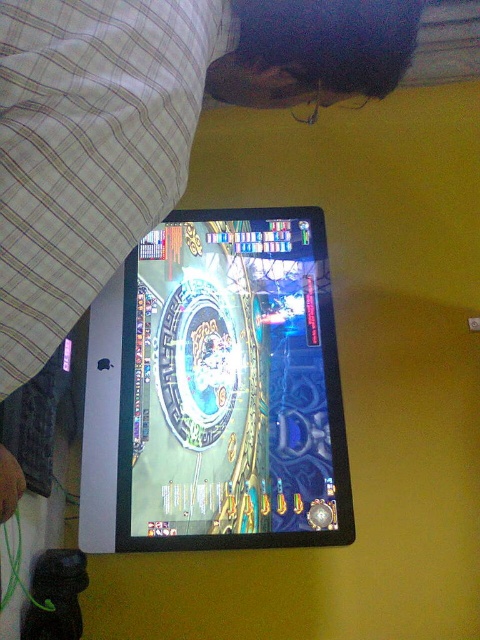
Question: Does matte black tablet at center have a lesser width compared to glossy plastic tablet at center?

Choices:
 (A) no
 (B) yes

Answer: (B)

Question: In this image, where is matte black tablet at center located relative to glossy plastic tablet at center?

Choices:
 (A) right
 (B) left

Answer: (B)

Question: Among these objects, which one is nearest to the camera?

Choices:
 (A) glossy plastic tablet at center
 (B) matte black tablet at center

Answer: (B)

Question: Observing the image, what is the correct spatial positioning of matte black tablet at center in reference to glossy plastic tablet at center?

Choices:
 (A) right
 (B) left

Answer: (B)